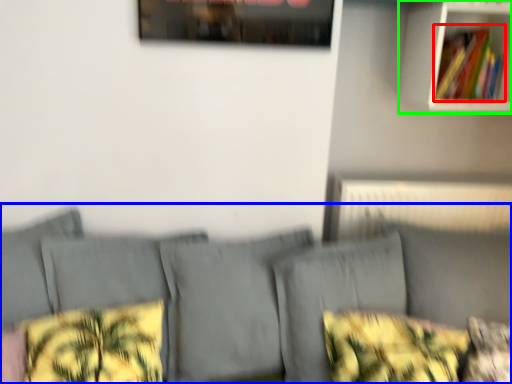
Question: Based on their relative distances, which object is nearer to book (highlighted by a red box)? Choose from couch (highlighted by a blue box) and shelf (highlighted by a green box).

Choices:
 (A) couch
 (B) shelf

Answer: (B)